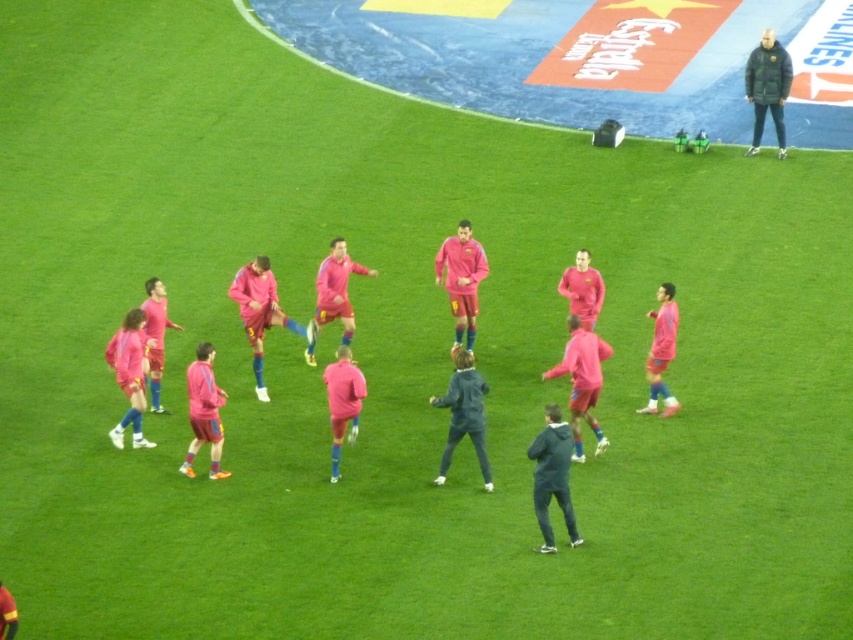
You are a photographer trying to capture a clear shot of the pink matte jersey at center without the dark green puffer jacket at upper right blocking the view. Based on their positions, do you think the jacket is in front of or behind the jersey?

The dark green puffer jacket at upper right might be wider than pink matte jersey at center, so it could potentially block the view of the pink matte jersey at center depending on their depth positions.

You are a photographer standing at the edge of the soccer field. You want to capture a photo of the pink matte soccer uniforms at center. Based on their position, which direction should you aim your camera to ensure they are centered in the frame?

The pink matte soccer uniforms at center are located at coordinates point (582, 380). To center them in your frame, aim your camera slightly to the right and upwards since the coordinates suggest they are positioned to the right of the exact center horizontally and above the vertical center.

You are a photographer standing at the edge of the soccer field. You need to capture a photo that includes both the dark blue jacket at center and the dark green puffer jacket at upper right. Based on their positions, which jacket will appear closer to the top of the photo?

The dark green puffer jacket at upper right will appear closer to the top of the photo because it is positioned higher up than the dark blue jacket at center.